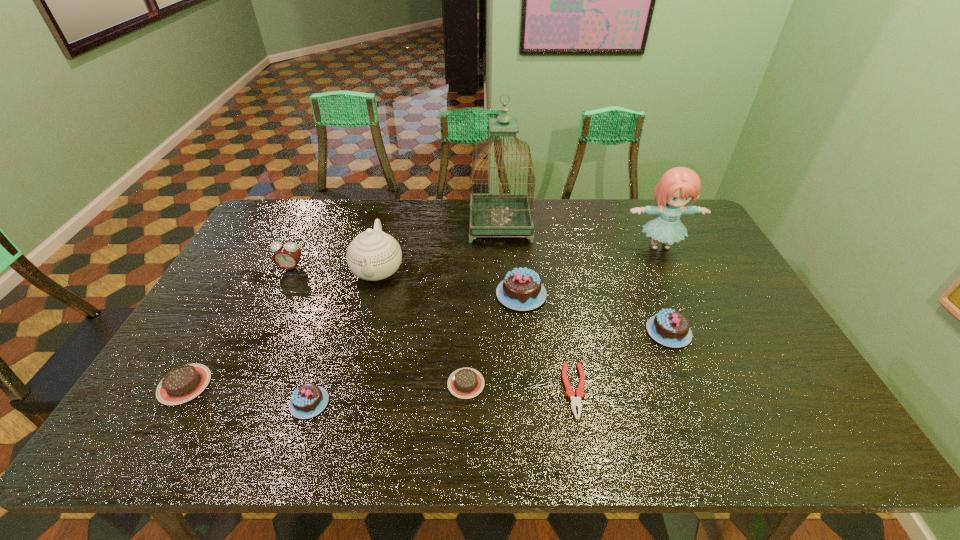
The image size is (960, 540). In order to click on empty space between the leftmost chocolate cake and the chinaware in this screenshot , I will do `click(281, 327)`.

The width and height of the screenshot is (960, 540). Find the location of `vacant region between the second chocolate cake from left to right and the second tallest object`. vacant region between the second chocolate cake from left to right and the second tallest object is located at coordinates (485, 325).

This screenshot has height=540, width=960. I want to click on object that ranks as the eighth closest to the alarm clock, so click(671, 328).

Identify which object is located as the ninth nearest to the tallest chocolate cake. Please provide its 2D coordinates. Your answer should be formatted as a tuple, i.e. [(x, y)], where the tuple contains the x and y coordinates of a point satisfying the conditions above.

[(181, 384)]

Point out which chocolate cake is positioned as the nearest to the greenish birdcage. Please provide its 2D coordinates. Your answer should be formatted as a tuple, i.e. [(x, y)], where the tuple contains the x and y coordinates of a point satisfying the conditions above.

[(521, 289)]

Find the location of a particular element. The width and height of the screenshot is (960, 540). chocolate cake object that ranks as the fourth closest to the shortest object is located at coordinates (308, 400).

Identify which pink chocolate cake is the second nearest to the second chocolate cake from right to left. Please provide its 2D coordinates. Your answer should be formatted as a tuple, i.e. [(x, y)], where the tuple contains the x and y coordinates of a point satisfying the conditions above.

[(308, 400)]

Image resolution: width=960 pixels, height=540 pixels. In order to click on pink chocolate cake identified as the second closest to the doll in this screenshot , I will do `click(521, 289)`.

I want to click on vacant space that satisfies the following two spatial constraints: 1. on the back side of the rightmost chocolate cake; 2. at the door of the greenish birdcage, so click(x=624, y=225).

Locate an element on the screen. This screenshot has width=960, height=540. vacant region that satisfies the following two spatial constraints: 1. on the back side of the second farthest chocolate cake; 2. at the door of the greenish birdcage is located at coordinates (624, 225).